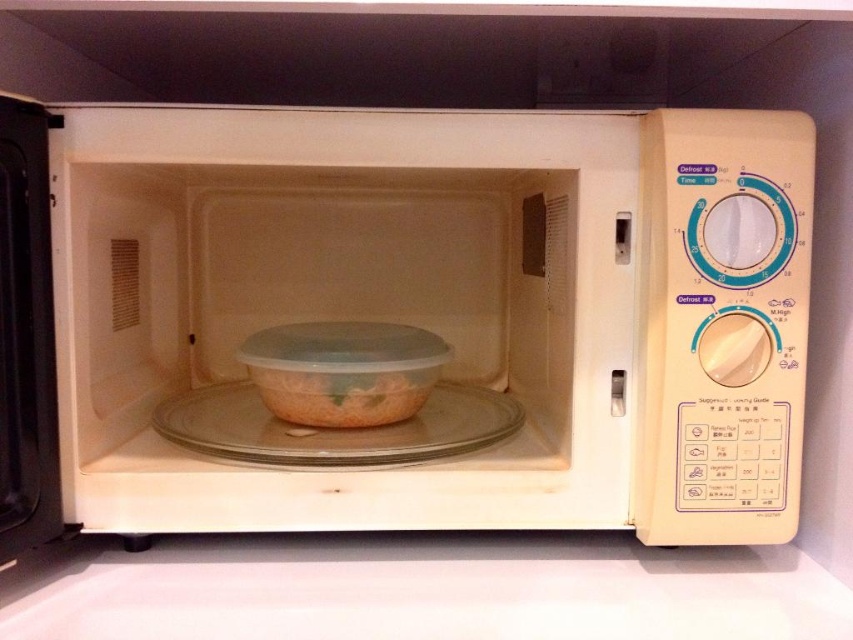
Question: Can you confirm if white plastic microwave at center is positioned to the left of clear glass plate at center?

Choices:
 (A) no
 (B) yes

Answer: (A)

Question: Can you confirm if white plastic microwave at center is thinner than translucent plastic bowl at center?

Choices:
 (A) yes
 (B) no

Answer: (B)

Question: Among these objects, which one is farthest from the camera?

Choices:
 (A) white matte counter top at lower center
 (B) clear glass plate at center
 (C) white plastic microwave at center

Answer: (B)

Question: Can you confirm if white plastic microwave at center is positioned above translucent plastic bowl at center?

Choices:
 (A) no
 (B) yes

Answer: (B)

Question: Which object is the closest to the white plastic microwave at center?

Choices:
 (A) white matte counter top at lower center
 (B) clear glass plate at center
 (C) translucent plastic bowl at center

Answer: (B)

Question: Which point is closer to the camera taking this photo?

Choices:
 (A) (186, 458)
 (B) (370, 410)
 (C) (724, 632)

Answer: (C)